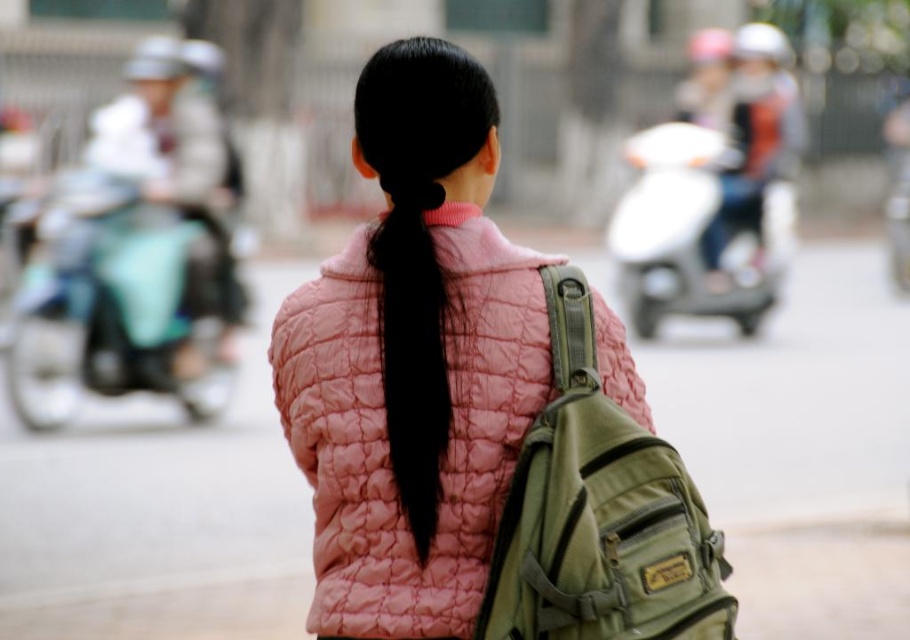
You are a pedestrian trying to cross the street safely. You see an olive green canvas backpack at center and a white glossy motorcycle at center. Which object is closer to you?

The olive green canvas backpack at center is closer to you because it is in front of the white glossy motorcycle at center.

You are a delivery person trying to decide which item to place on a shelf that can only hold items up to the height of the white glossy motorcycle at center. Can the olive green canvas backpack at center be placed there?

The olive green canvas backpack at center has a lesser height compared to the white glossy motorcycle at center, so it can be placed on the shelf since its height is less than the motorcycle.